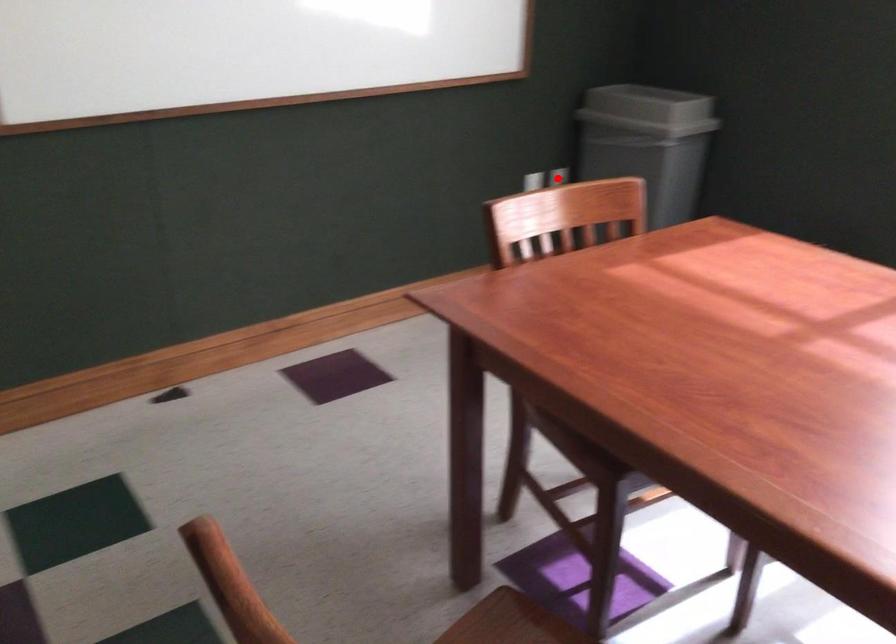
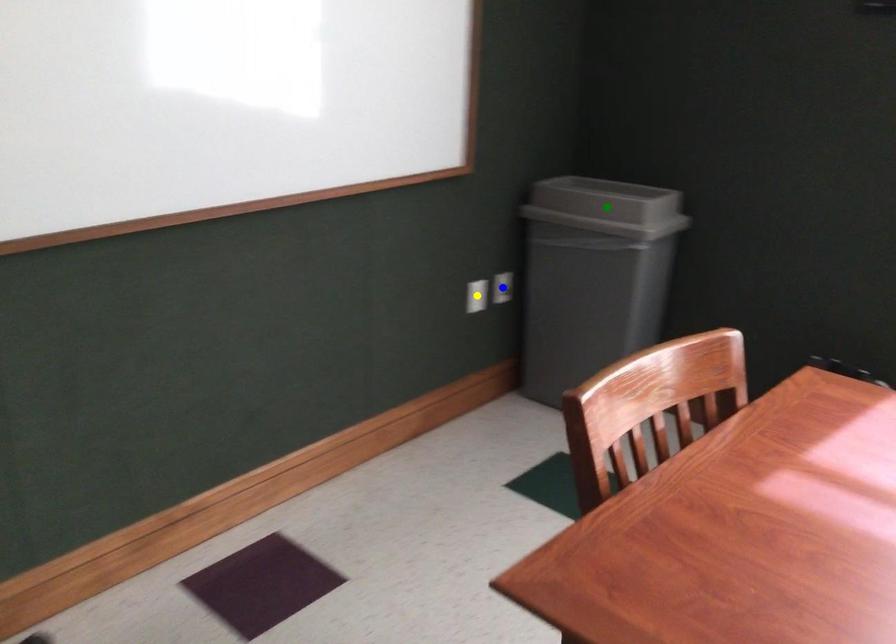
Question: I am providing you with two images of the same scene from different viewpoints. A red point is marked on the first image. You are given multiple points on the second image. In image 2, which mark is for the same physical point as the one in image 1?

Choices:
 (A) blue point
 (B) green point
 (C) yellow point

Answer: (A)